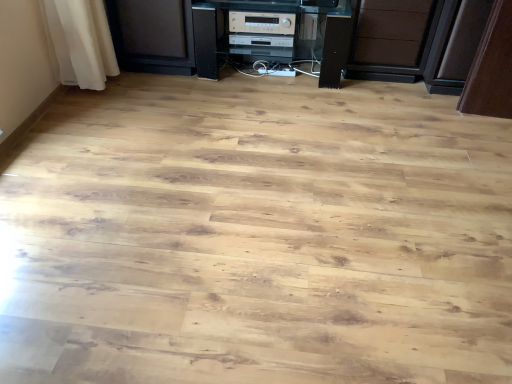
Question: Considering the relative sizes of silver metallic stereo at center, the second appliance viewed from the back, and brown matte drawer at center in the image provided, is silver metallic stereo at center, the second appliance viewed from the back, taller than brown matte drawer at center?

Choices:
 (A) yes
 (B) no

Answer: (B)

Question: From a real-world perspective, is silver metallic stereo at center, acting as the 1th appliance starting from the front, beneath brown matte drawer at center?

Choices:
 (A) no
 (B) yes

Answer: (A)

Question: Could you tell me if silver metallic stereo at center, the second appliance viewed from the back, is turned towards brown matte drawer at center?

Choices:
 (A) no
 (B) yes

Answer: (A)

Question: Is the position of silver metallic stereo at center, the second appliance viewed from the back, more distant than that of brown matte drawer at center?

Choices:
 (A) yes
 (B) no

Answer: (A)

Question: Is silver metallic stereo at center, acting as the 1th appliance starting from the front, in front of brown matte drawer at center?

Choices:
 (A) yes
 (B) no

Answer: (B)

Question: Is silver metallic stereo at center, positioned as the first appliance in back-to-front order, bigger or smaller than brown matte drawer at center?

Choices:
 (A) small
 (B) big

Answer: (A)

Question: In terms of height, does silver metallic stereo at center, positioned as the first appliance in back-to-front order, look taller or shorter compared to brown matte drawer at center?

Choices:
 (A) tall
 (B) short

Answer: (B)

Question: In the image, is silver metallic stereo at center, positioned as the first appliance in back-to-front order, positioned in front of or behind brown matte drawer at center?

Choices:
 (A) behind
 (B) front

Answer: (A)

Question: Would you say silver metallic stereo at center, positioned as the first appliance in back-to-front order, is inside or outside brown matte drawer at center?

Choices:
 (A) inside
 (B) outside

Answer: (B)

Question: Would you say black plastic stereo at center is to the left or to the right of silver metallic stereo at center, positioned as the first appliance in back-to-front order, in the picture?

Choices:
 (A) right
 (B) left

Answer: (A)

Question: Is black plastic stereo at center inside the boundaries of silver metallic stereo at center, positioned as the first appliance in back-to-front order, or outside?

Choices:
 (A) inside
 (B) outside

Answer: (B)

Question: Is black plastic stereo at center wider or thinner than silver metallic stereo at center, the second appliance in the front-to-back sequence?

Choices:
 (A) thin
 (B) wide

Answer: (B)

Question: In terms of height, does black plastic stereo at center look taller or shorter compared to silver metallic stereo at center, the second appliance in the front-to-back sequence?

Choices:
 (A) short
 (B) tall

Answer: (B)

Question: In the image, is silver metallic stereo at center, the second appliance viewed from the back, on the left side or the right side of silver metallic stereo at center, the second appliance in the front-to-back sequence?

Choices:
 (A) right
 (B) left

Answer: (A)

Question: From a real-world perspective, is silver metallic stereo at center, the second appliance viewed from the back, positioned above or below silver metallic stereo at center, the second appliance in the front-to-back sequence?

Choices:
 (A) below
 (B) above

Answer: (B)